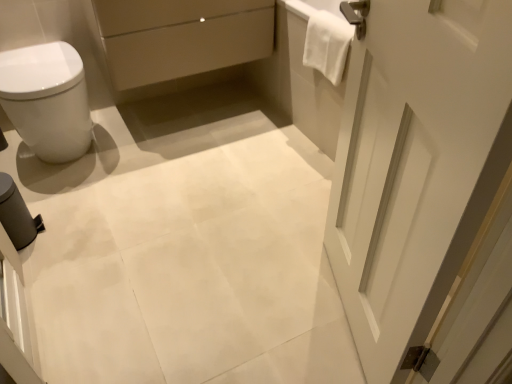
Question: Considering the positions of white glossy bidet at left and white towel at upper right in the image, is white glossy bidet at left wider or thinner than white towel at upper right?

Choices:
 (A) thin
 (B) wide

Answer: (B)

Question: Considering the positions of white glossy bidet at left and white towel at upper right in the image, is white glossy bidet at left taller or shorter than white towel at upper right?

Choices:
 (A) tall
 (B) short

Answer: (A)

Question: Estimate the real-world distances between objects in this image. Which object is farther from the white towel at upper right?

Choices:
 (A) white matte door at right
 (B) matte beige drawer at upper center
 (C) white glossy bidet at left

Answer: (C)

Question: Based on their relative distances, which object is nearer to the white glossy bidet at left?

Choices:
 (A) white matte door at right
 (B) white towel at upper right
 (C) matte beige drawer at upper center

Answer: (C)